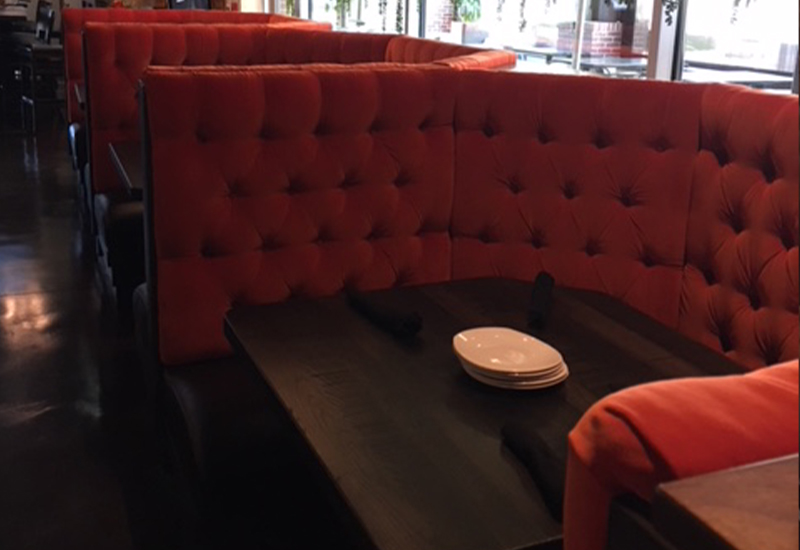
Locate an element on the screen. The width and height of the screenshot is (800, 550). red velvet seating is located at coordinates (310, 214), (608, 242), (728, 261), (686, 425), (194, 46), (397, 49), (342, 44), (230, 20), (117, 16).